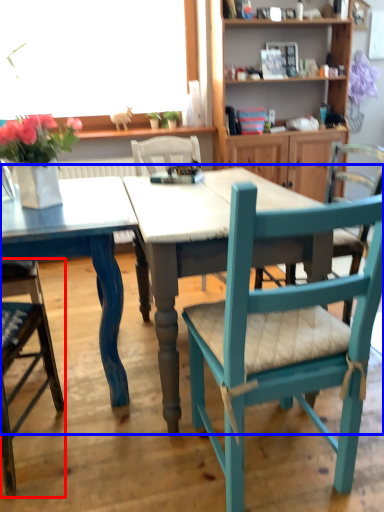
Question: Which of the following is the farthest to the observer, chair (highlighted by a red box) or kitchen & dining room table (highlighted by a blue box)?

Choices:
 (A) chair
 (B) kitchen & dining room table

Answer: (B)